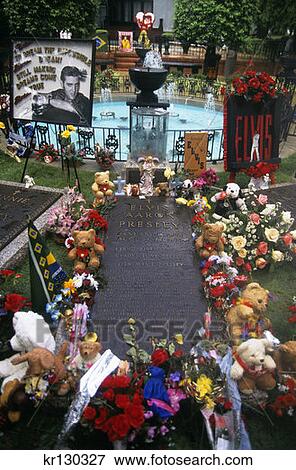
This screenshot has height=470, width=296. Identify the location of stuffed animals. (269, 369), (259, 318), (232, 197), (208, 233), (103, 180), (83, 241), (27, 362), (14, 338), (91, 346).